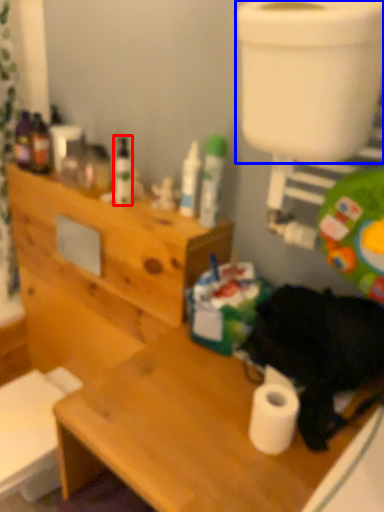
Question: Which object appears closest to the camera in this image, toiletry (highlighted by a red box) or toilet bowl (highlighted by a blue box)?

Choices:
 (A) toiletry
 (B) toilet bowl

Answer: (B)